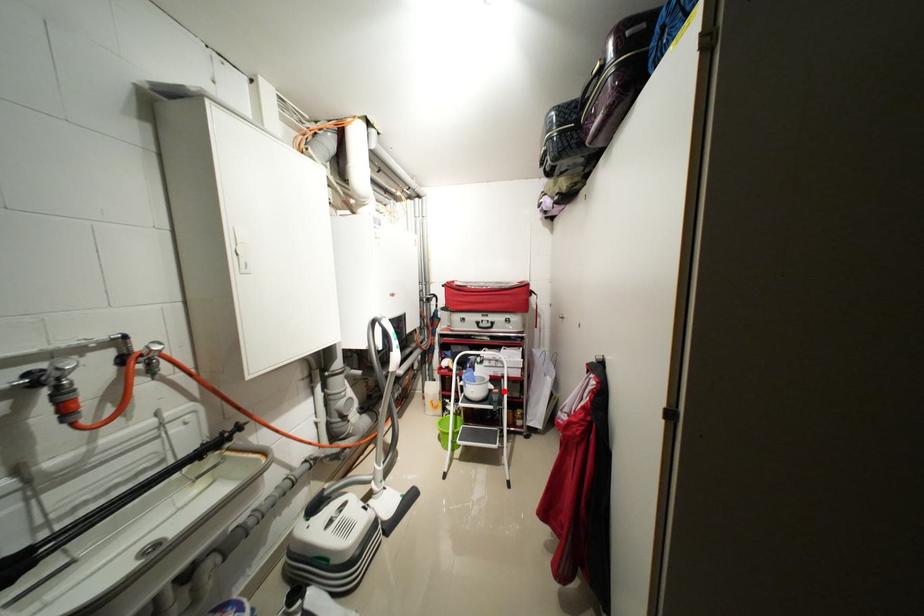
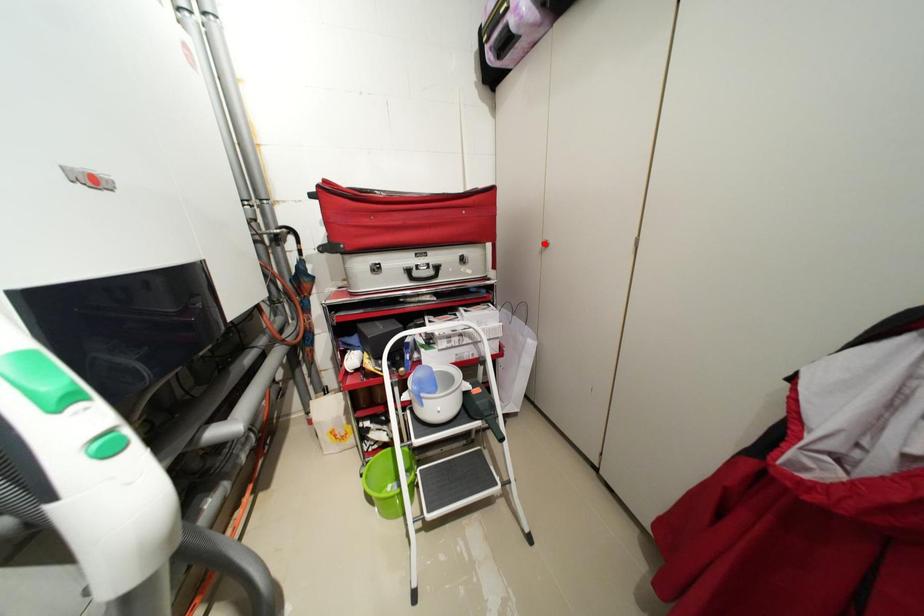
I am providing you with two images of the same scene from different viewpoints. A red point is marked on the first image and another point is marked on the second image. Is the marked point in image1 the same physical position as the marked point in image2?

No